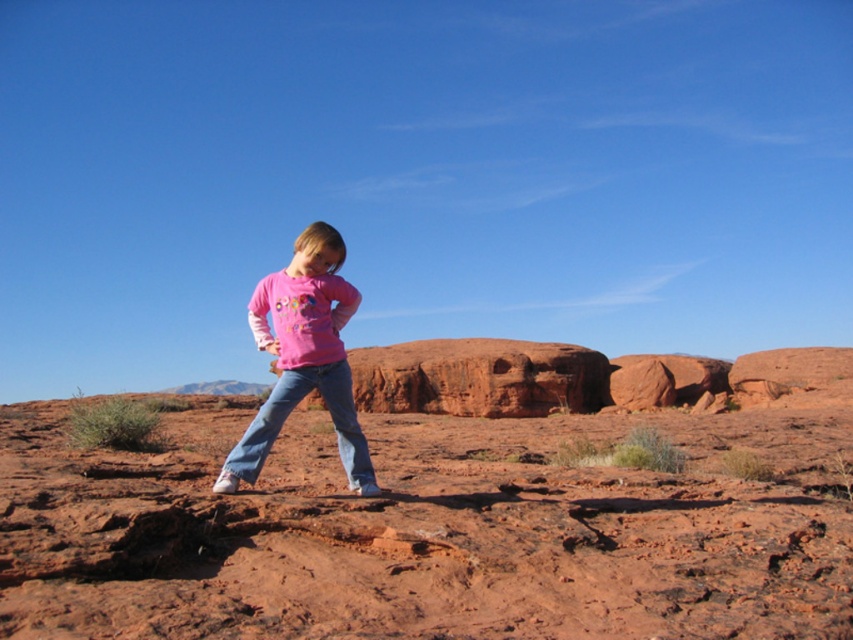
What object is located at the coordinates point [303,356] in the image?

The point [303,356] indicates the pink cotton shirt at center.

You are a drone operator trying to land a drone on the smooth sand at center. The drone has a GPS coordinate of point (432, 529). Will the drone land on the smooth sand at center?

Yes, the point (432, 529) is on smooth sand at center, so the drone will land on the smooth sand at center.

You are a drone operator trying to capture a photo of the smooth sand at center. The drone has a maximum safe flying distance of 5 meters. Can the drone safely capture the photo from its current position?

The smooth sand at center is 5.08 meters from camera. Since the drone has a maximum safe flying distance of 5 meters, it cannot safely capture the photo from its current position as the distance exceeds the limit.